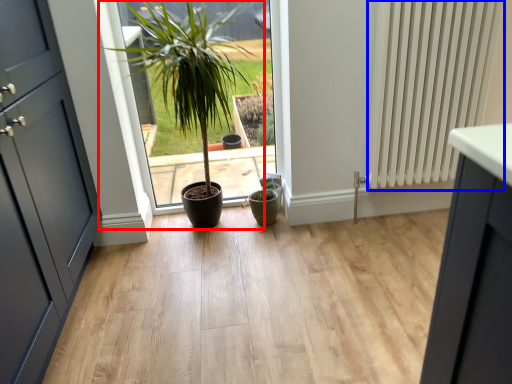
Question: Which object appears farthest to the camera in this image, houseplant (highlighted by a red box) or radiator (highlighted by a blue box)?

Choices:
 (A) houseplant
 (B) radiator

Answer: (B)